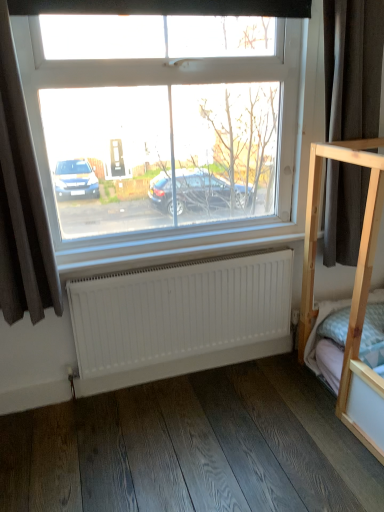
Question: Is brown fabric curtain at left, which is the 1th curtain in left-to-right order, positioned beyond the bounds of dark gray fabric at right, placed as the 1th curtain when sorted from right to left?

Choices:
 (A) no
 (B) yes

Answer: (B)

Question: Considering the relative positions of brown fabric curtain at left, the 2th curtain viewed from the right, and dark gray fabric at right, placed as the 1th curtain when sorted from right to left, in the image provided, is brown fabric curtain at left, the 2th curtain viewed from the right, in front of dark gray fabric at right, placed as the 1th curtain when sorted from right to left,?

Choices:
 (A) no
 (B) yes

Answer: (B)

Question: Is brown fabric curtain at left, the 2th curtain viewed from the right, facing towards dark gray fabric at right, which is the 2th curtain in left-to-right order?

Choices:
 (A) no
 (B) yes

Answer: (A)

Question: From a real-world perspective, is brown fabric curtain at left, the 2th curtain viewed from the right, located beneath dark gray fabric at right, which is the 2th curtain in left-to-right order?

Choices:
 (A) no
 (B) yes

Answer: (B)

Question: Considering the relative positions of brown fabric curtain at left, the 2th curtain viewed from the right, and dark gray fabric at right, which is the 2th curtain in left-to-right order, in the image provided, is brown fabric curtain at left, the 2th curtain viewed from the right, to the left of dark gray fabric at right, which is the 2th curtain in left-to-right order, from the viewer's perspective?

Choices:
 (A) yes
 (B) no

Answer: (A)

Question: Is dark wood flooring at lower center taller or shorter than dark gray fabric at right, which is the 2th curtain in left-to-right order?

Choices:
 (A) tall
 (B) short

Answer: (B)

Question: Is dark wood flooring at lower center to the left or to the right of dark gray fabric at right, which is the 2th curtain in left-to-right order, in the image?

Choices:
 (A) right
 (B) left

Answer: (B)

Question: Is point (225, 432) positioned closer to the camera than point (339, 20)?

Choices:
 (A) farther
 (B) closer

Answer: (A)

Question: From a real-world perspective, relative to dark gray fabric at right, placed as the 1th curtain when sorted from right to left, is dark wood flooring at lower center vertically above or below?

Choices:
 (A) below
 (B) above

Answer: (A)

Question: Which is correct: dark gray fabric at right, placed as the 1th curtain when sorted from right to left, is inside white matte radiator at lower center, or outside of it?

Choices:
 (A) inside
 (B) outside

Answer: (B)

Question: Relative to white matte radiator at lower center, is dark gray fabric at right, placed as the 1th curtain when sorted from right to left, in front or behind?

Choices:
 (A) behind
 (B) front

Answer: (B)

Question: In terms of size, does dark gray fabric at right, which is the 2th curtain in left-to-right order, appear bigger or smaller than white matte radiator at lower center?

Choices:
 (A) small
 (B) big

Answer: (B)

Question: In the image, is dark gray fabric at right, which is the 2th curtain in left-to-right order, on the left side or the right side of white matte radiator at lower center?

Choices:
 (A) left
 (B) right

Answer: (B)

Question: Considering the positions of white matte radiator at lower center and brown fabric curtain at left, the 2th curtain viewed from the right, in the image, is white matte radiator at lower center bigger or smaller than brown fabric curtain at left, the 2th curtain viewed from the right,?

Choices:
 (A) big
 (B) small

Answer: (A)

Question: Considering their positions, is white matte radiator at lower center located in front of or behind brown fabric curtain at left, which is the 1th curtain in left-to-right order?

Choices:
 (A) behind
 (B) front

Answer: (A)